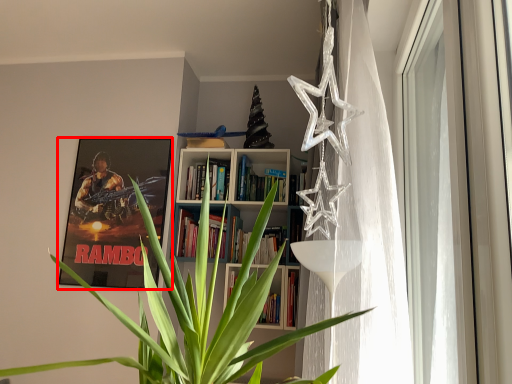
Question: Considering the relative positions of picture frame (annotated by the red box) and window in the image provided, where is picture frame (annotated by the red box) located with respect to the staircase?

Choices:
 (A) left
 (B) right

Answer: (A)